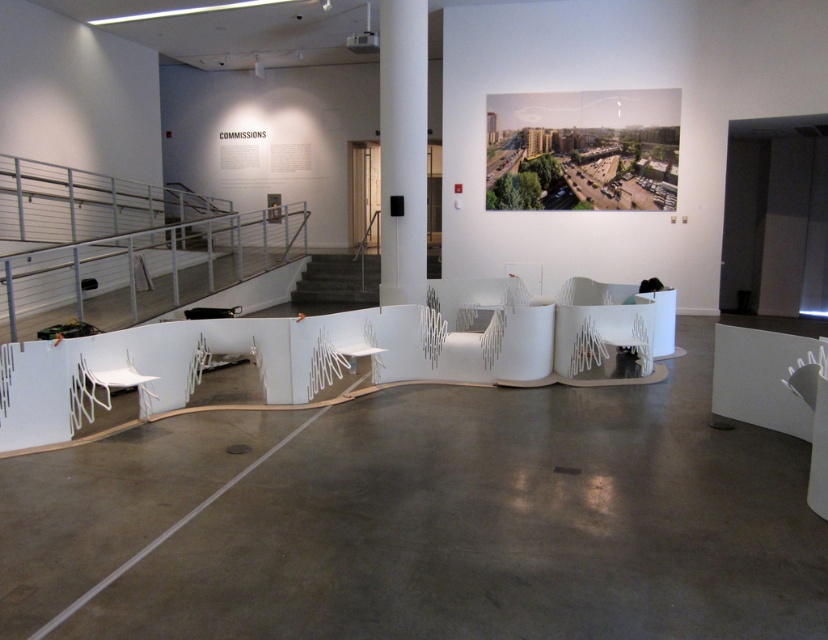
You are an interior designer planning to place a 1.2 meter wide sculpture between the white matte column at center and the dark gray concrete stairs at center. Based on their widths, will the sculpture fit in the space between them?

The white matte column at center is narrower than the dark gray concrete stairs at center. Since the sculpture is 1.2 meters wide, it depends on the actual width of the space between them. However, the description only mentions their relative widths, not the distance between them. Therefore, we cannot determine if the sculpture will fit based solely on the provided information.